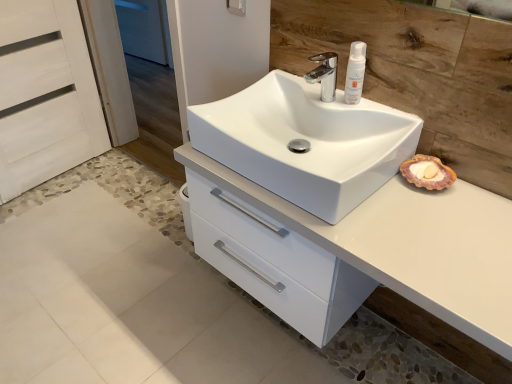
Question: From a real-world perspective, is white wood screen door at left, acting as the second screen door starting from the left, located beneath chrome metallic faucet at upper center?

Choices:
 (A) yes
 (B) no

Answer: (A)

Question: From the image's perspective, is white wood screen door at left, acting as the second screen door starting from the left, beneath chrome metallic faucet at upper center?

Choices:
 (A) no
 (B) yes

Answer: (A)

Question: Would you say white wood screen door at left, acting as the second screen door starting from the left, contains chrome metallic faucet at upper center?

Choices:
 (A) no
 (B) yes

Answer: (A)

Question: Could you tell me if white wood screen door at left, which appears as the 1th screen door when viewed from the right, is facing chrome metallic faucet at upper center?

Choices:
 (A) yes
 (B) no

Answer: (B)

Question: Is the depth of white wood screen door at left, which appears as the 1th screen door when viewed from the right, less than that of chrome metallic faucet at upper center?

Choices:
 (A) yes
 (B) no

Answer: (B)

Question: In the image, is white wood screen door at left, which appears as the 1th screen door when viewed from the right, on the left side or the right side of white glossy cabinet at center?

Choices:
 (A) left
 (B) right

Answer: (A)

Question: From a real-world perspective, is white wood screen door at left, acting as the second screen door starting from the left, physically located above or below white glossy cabinet at center?

Choices:
 (A) below
 (B) above

Answer: (B)

Question: From the image's perspective, is white wood screen door at left, which appears as the 1th screen door when viewed from the right, above or below white glossy cabinet at center?

Choices:
 (A) above
 (B) below

Answer: (A)

Question: Is white wood screen door at left, acting as the second screen door starting from the left, bigger or smaller than white glossy cabinet at center?

Choices:
 (A) small
 (B) big

Answer: (A)

Question: Relative to white matte lotion at upper right, is white glossy sink at center in front or behind?

Choices:
 (A) front
 (B) behind

Answer: (A)

Question: Considering the positions of white glossy sink at center and white matte lotion at upper right in the image, is white glossy sink at center bigger or smaller than white matte lotion at upper right?

Choices:
 (A) small
 (B) big

Answer: (B)

Question: Would you say white glossy sink at center is to the left or to the right of white matte lotion at upper right in the picture?

Choices:
 (A) right
 (B) left

Answer: (B)

Question: Does point (198, 135) appear closer or farther from the camera than point (361, 59)?

Choices:
 (A) farther
 (B) closer

Answer: (A)

Question: Is chrome metallic faucet at upper center inside the boundaries of white matte lotion at upper right, or outside?

Choices:
 (A) inside
 (B) outside

Answer: (B)

Question: Visually, is chrome metallic faucet at upper center positioned to the left or to the right of white matte lotion at upper right?

Choices:
 (A) left
 (B) right

Answer: (A)